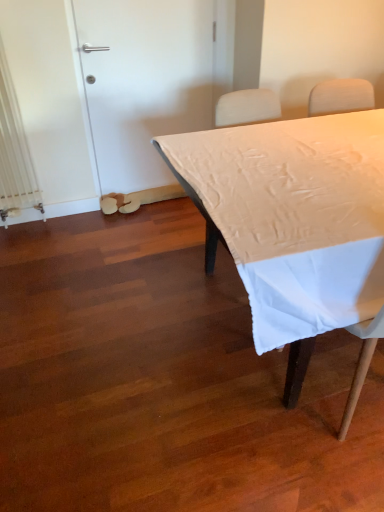
From the picture: What is the approximate width of white matte table at center?

3.44 feet.

In order to face white matte table at center, should I rotate leftwards or rightwards?

To face it directly, rotate right by 19.710 degrees.

The width and height of the screenshot is (384, 512). What are the coordinates of `white matte table at center` in the screenshot? It's located at (293, 219).

The height and width of the screenshot is (512, 384). What do you see at coordinates (293, 219) in the screenshot?
I see `white matte table at center` at bounding box center [293, 219].

What is the approximate height of white matte door at upper left?

4.07 feet.

Describe the element at coordinates (143, 82) in the screenshot. I see `white matte door at upper left` at that location.

Where is `white matte door at upper left`? The height and width of the screenshot is (512, 384). white matte door at upper left is located at coordinates (143, 82).

This screenshot has width=384, height=512. In order to click on white matte table at center in this screenshot , I will do point(293,219).

Does white matte door at upper left appear on the left side of white matte table at center?

Yes, white matte door at upper left is to the left of white matte table at center.

Based on the photo, does white matte door at upper left lie in front of white matte table at center?

No, white matte door at upper left is behind white matte table at center.

Considering the points (161, 161) and (200, 202), which point is behind, point (161, 161) or point (200, 202)?

The point (161, 161) is farther.

From the image's perspective, is white matte door at upper left located above or below white matte table at center?

From the image's perspective, white matte door at upper left appears above white matte table at center.

Consider the image. From a real-world perspective, relative to white matte table at center, is white matte door at upper left vertically above or below?

From a real-world perspective, white matte door at upper left is physically above white matte table at center.

Can you confirm if white matte door at upper left is thinner than white matte table at center?

Yes, white matte door at upper left is thinner than white matte table at center.

Does white matte door at upper left have a greater height compared to white matte table at center?

Indeed, white matte door at upper left has a greater height compared to white matte table at center.

Which of these two, white matte door at upper left or white matte table at center, is smaller?

With smaller size is white matte door at upper left.

Is white matte door at upper left not within white matte table at center?

white matte door at upper left is positioned outside white matte table at center.

Is white matte door at upper left placed right next to white matte table at center?

white matte door at upper left and white matte table at center are not in contact.

Does white matte door at upper left turn towards white matte table at center?

Yes, white matte door at upper left is turned towards white matte table at center.

What's the angular difference between white matte door at upper left and white matte table at center's facing directions?

The angle between the facing direction of white matte door at upper left and the facing direction of white matte table at center is 0.304 degrees.

How much distance is there between white matte door at upper left and white matte table at center?

They are 4.07 feet apart.

I want to click on table on the right of white matte door at upper left, so [293, 219].

Is white matte table at center to the left of white matte door at upper left from the viewer's perspective?

No.

In the image, is white matte table at center positioned in front of or behind white matte door at upper left?

white matte table at center is in front of white matte door at upper left.

Which is in front, point (320, 220) or point (143, 67)?

Point (320, 220)

From the image's perspective, between white matte table at center and white matte door at upper left, which one is located above?

white matte door at upper left.

Looking at this image, from a real-world perspective, does white matte table at center sit lower than white matte door at upper left?

Correct, in the physical world, white matte table at center is lower than white matte door at upper left.

Which of these two, white matte table at center or white matte door at upper left, is thinner?

white matte door at upper left.

In terms of height, does white matte table at center look taller or shorter compared to white matte door at upper left?

white matte table at center is shorter than white matte door at upper left.

Is white matte table at center smaller than white matte door at upper left?

No.

Is white matte table at center inside the boundaries of white matte door at upper left, or outside?

The correct answer is: outside.

Would you say white matte table at center is a long distance from white matte door at upper left?

Yes, white matte table at center and white matte door at upper left are quite far apart.

Could you tell me if white matte table at center is facing white matte door at upper left?

No, white matte table at center does not turn towards white matte door at upper left.

What's the angular difference between white matte table at center and white matte door at upper left's facing directions?

They differ by 0.304 degrees in their facing directions.

At what (x,y) coordinates should I click in order to perform the action: click on door above the white matte table at center (from a real-world perspective). Please return your answer as a coordinate pair (x, y). This screenshot has width=384, height=512. Looking at the image, I should click on (143, 82).

The height and width of the screenshot is (512, 384). In order to click on door that appears above the white matte table at center (from the image's perspective) in this screenshot , I will do `click(143, 82)`.

Locate an element on the screen. table in front of the white matte door at upper left is located at coordinates (293, 219).